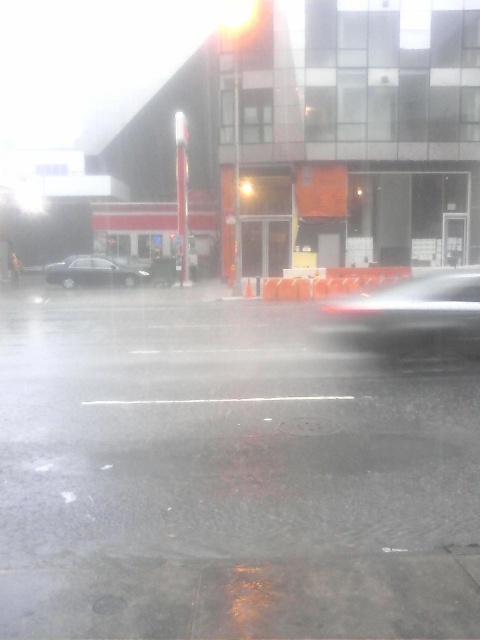
Question: Which object is closer to the camera taking this photo?

Choices:
 (A) satin black sedan at center
 (B) shiny silver sedan at center
 (C) orange plastic barrier at center

Answer: (B)

Question: From the image, what is the correct spatial relationship of shiny silver sedan at center in relation to orange plastic barrier at center?

Choices:
 (A) right
 (B) left

Answer: (A)

Question: Can you confirm if satin black sedan at center is positioned above orange plastic barrier at center?

Choices:
 (A) yes
 (B) no

Answer: (A)

Question: Which point appears farthest from the camera in this image?

Choices:
 (A) pyautogui.click(x=48, y=264)
 (B) pyautogui.click(x=452, y=298)

Answer: (A)

Question: Which of the following is the farthest from the observer?

Choices:
 (A) (370, 282)
 (B) (66, 285)
 (C) (394, 342)

Answer: (B)

Question: Can you confirm if shiny silver sedan at center is bigger than satin black sedan at center?

Choices:
 (A) no
 (B) yes

Answer: (B)